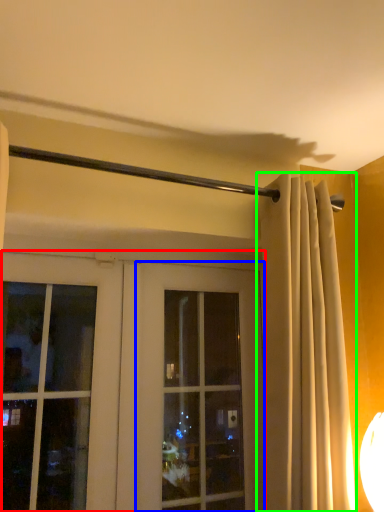
Question: Estimate the real-world distances between objects in this image. Which object is farther from door (highlighted by a red box), window (highlighted by a blue box) or curtain (highlighted by a green box)?

Choices:
 (A) window
 (B) curtain

Answer: (B)